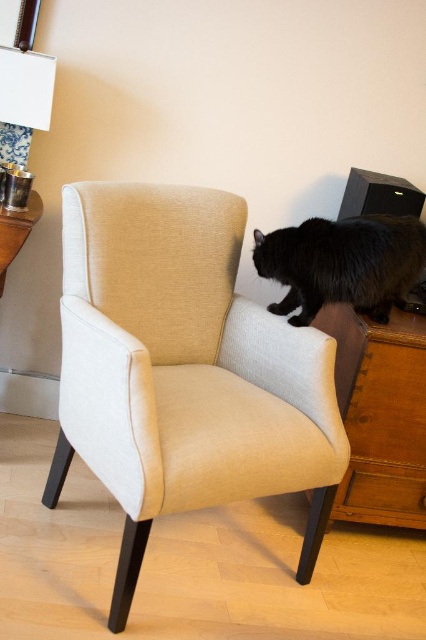
Between beige fabric swivel chair at center and brown wooden dresser at lower right, which one has more height?

beige fabric swivel chair at center is taller.

What do you see at coordinates (184, 369) in the screenshot? This screenshot has width=426, height=640. I see `beige fabric swivel chair at center` at bounding box center [184, 369].

What do you see at coordinates (184, 369) in the screenshot? This screenshot has height=640, width=426. I see `beige fabric swivel chair at center` at bounding box center [184, 369].

At what (x,y) coordinates should I click in order to perform the action: click on beige fabric swivel chair at center. Please return your answer as a coordinate pair (x, y). Looking at the image, I should click on (184, 369).

Is brown wooden dresser at lower right smaller than black fluffy cat on the right?

No.

Which is behind, point (356, 502) or point (339, 257)?

Point (356, 502)

The width and height of the screenshot is (426, 640). Identify the location of brown wooden dresser at lower right. (380, 416).

Is beige fabric swivel chair at center to the left of black fluffy cat on the right from the viewer's perspective?

Indeed, beige fabric swivel chair at center is positioned on the left side of black fluffy cat on the right.

Does beige fabric swivel chair at center have a lesser height compared to black fluffy cat on the right?

In fact, beige fabric swivel chair at center may be taller than black fluffy cat on the right.

Who is more distant from viewer, (141, 301) or (368, 291)?

The point (141, 301) is behind.

Locate an element on the screen. beige fabric swivel chair at center is located at coordinates (184, 369).